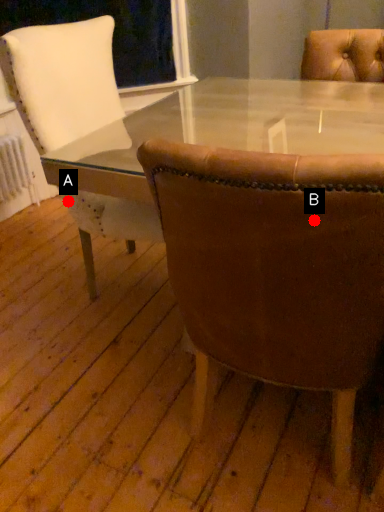
Question: Two points are circled on the image, labeled by A and B beside each circle. Which point is closer to the camera?

Choices:
 (A) A is closer
 (B) B is closer

Answer: (B)